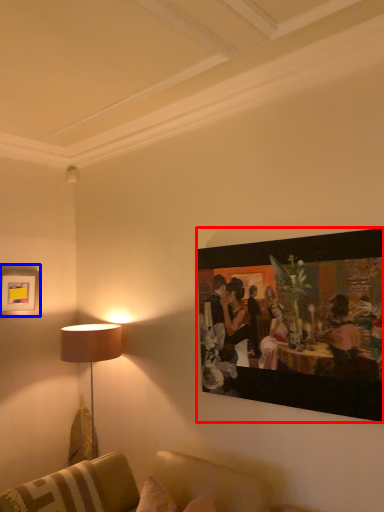
Question: Among these objects, which one is farthest to the camera, picture frame (highlighted by a red box) or picture frame (highlighted by a blue box)?

Choices:
 (A) picture frame
 (B) picture frame

Answer: (B)